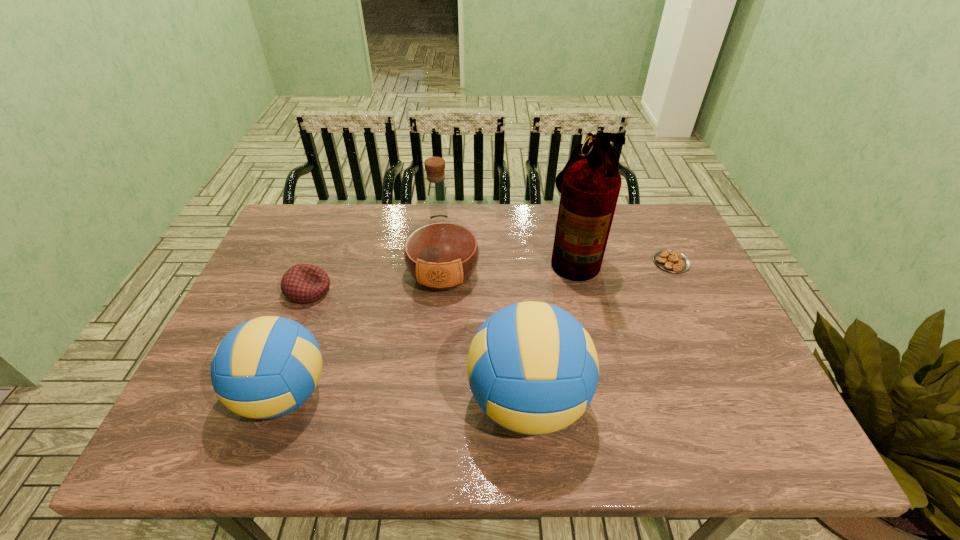
Please point a spot to add another volleyball on the right. Please provide its 2D coordinates. Your answer should be formatted as a tuple, i.e. [(x, y)], where the tuple contains the x and y coordinates of a point satisfying the conditions above.

[(778, 409)]